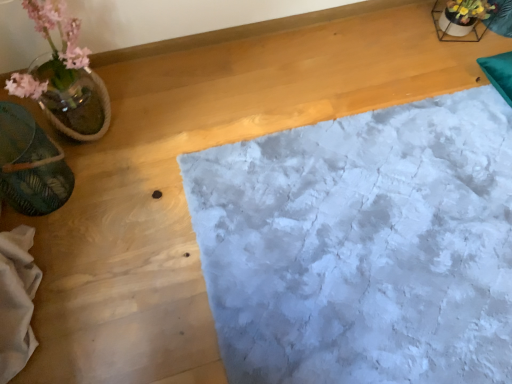
Question: Considering their positions, is translucent glass vase at left located in front of or behind green leafy material at left?

Choices:
 (A) front
 (B) behind

Answer: (A)

Question: Is point (52, 4) positioned closer to the camera than point (31, 135)?

Choices:
 (A) farther
 (B) closer

Answer: (B)

Question: Estimate the real-world distances between objects in this image. Which object is farther from the white textured rug at center?

Choices:
 (A) green leafy material at left
 (B) translucent glass vase at left

Answer: (A)

Question: Which object is positioned farthest from the green leafy material at left?

Choices:
 (A) white textured rug at center
 (B) translucent glass vase at left

Answer: (A)